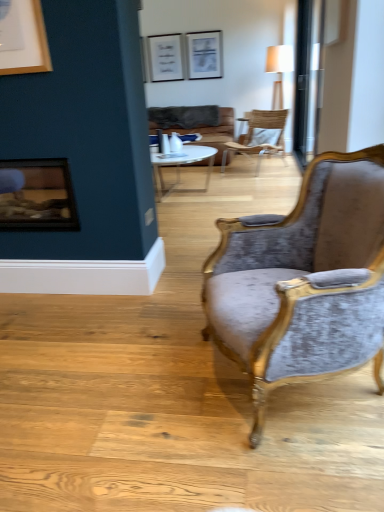
Question: From a real-world perspective, is velvet grey chair at center, acting as the second chair starting from the top, positioned above or below brown leather couch at center?

Choices:
 (A) above
 (B) below

Answer: (A)

Question: From the image's perspective, relative to brown leather couch at center, is velvet grey chair at center, which is the first chair from bottom to top, above or below?

Choices:
 (A) above
 (B) below

Answer: (B)

Question: Estimate the real-world distances between objects in this image. Which object is closer to the wooden textured chair at center, which is the 1th chair from back to front?

Choices:
 (A) transparent glass door at upper right
 (B) velvet grey chair at center, which appears as the first chair when viewed from the front
 (C) white glass coffee table at center
 (D) brown leather couch at center
 (E) metallic silver picture frame at upper center

Answer: (D)

Question: Which object is positioned closest to the transparent glass door at upper right?

Choices:
 (A) brown leather couch at center
 (B) wooden textured chair at center, the 2th chair positioned from the front
 (C) white glass coffee table at center
 (D) wooden frame fireplace at left
 (E) metallic silver picture frame at upper center

Answer: (B)